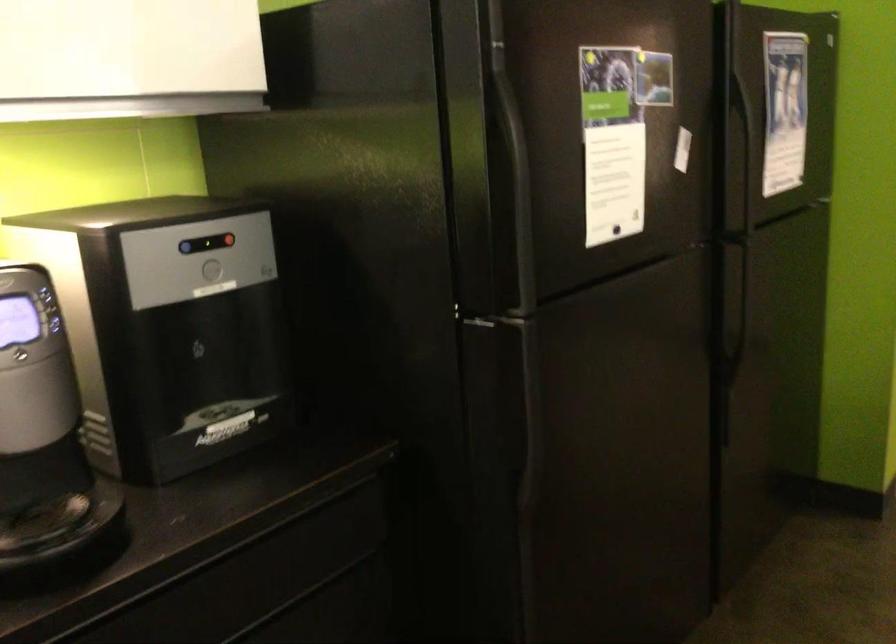
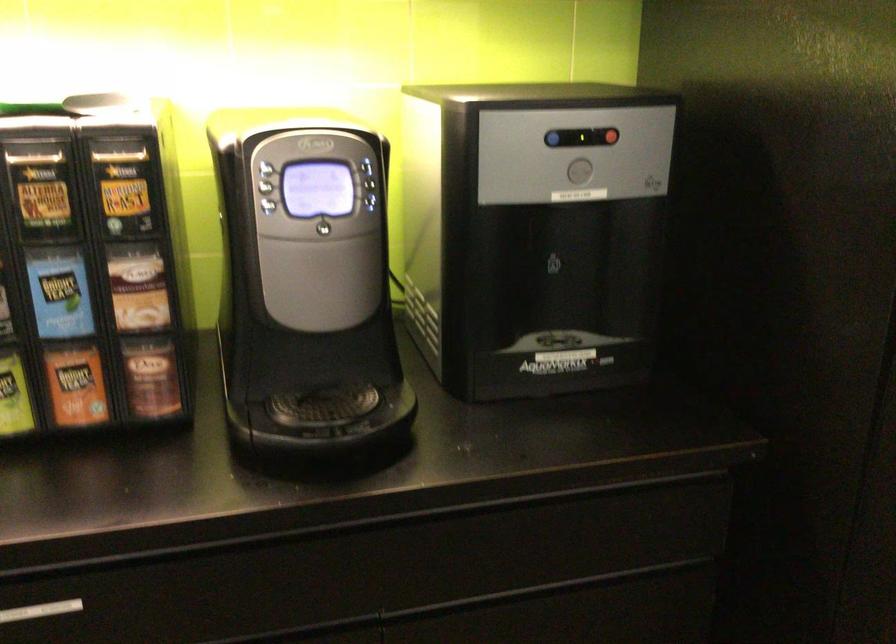
The point at [183,250] is marked in the first image. Where is the corresponding point in the second image?

(552, 138)